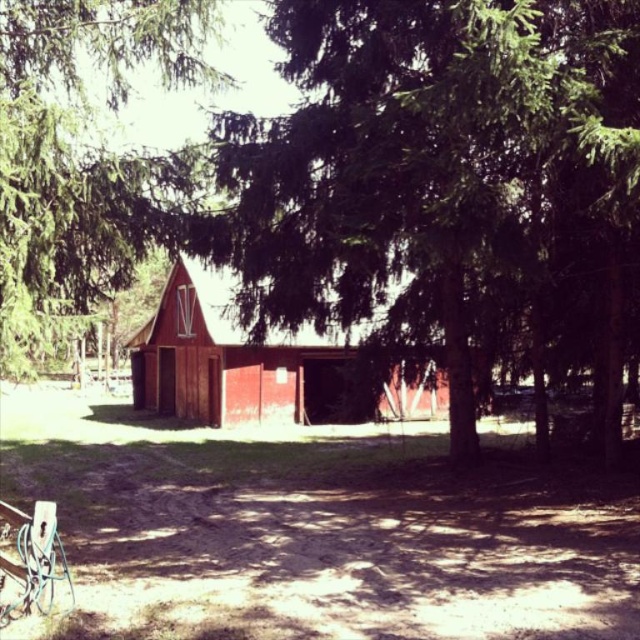
You are standing in a forest clearing and see the green leafy tree at left and the matte red barn at center. Which object is closer to you?

The green leafy tree at left is closer to you because it is in front of the matte red barn at center.

You are an architect designing a new garden layout. You have to place a statue exactly halfway between the green leafy tree at left and the matte red barn at center. Which object will the statue be closer to?

The statue will be closer to the matte red barn at center because the green leafy tree at left is smaller than the matte red barn at center, meaning the barn is larger and thus the distance from the tree to the midpoint would be shorter than from the barn to the midpoint.